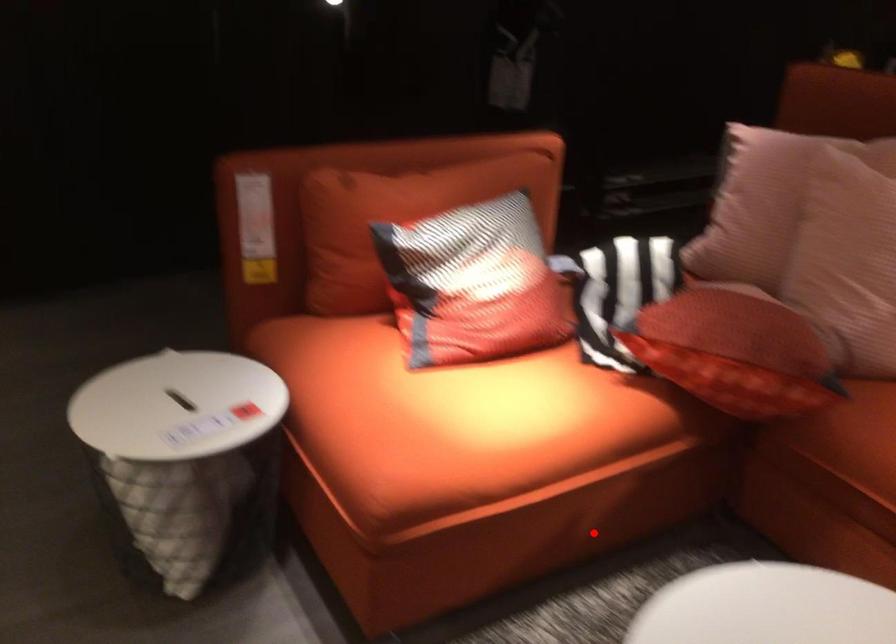
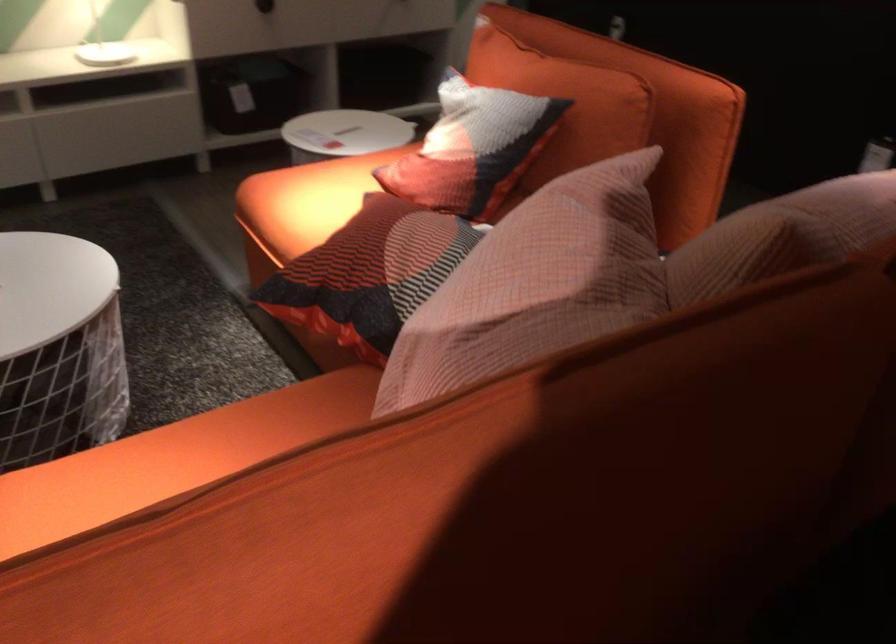
Find the pixel in the second image that matches the highlighted location in the first image.

(322, 348)